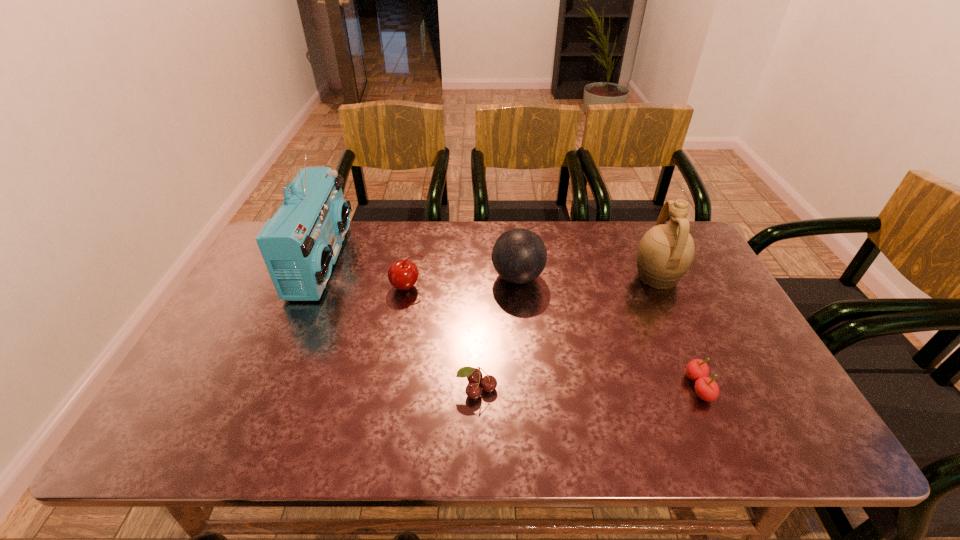
Image resolution: width=960 pixels, height=540 pixels. In order to click on radio receiver in this screenshot , I will do `click(300, 244)`.

Image resolution: width=960 pixels, height=540 pixels. What are the coordinates of `the leftmost object` in the screenshot? It's located at (300, 244).

The image size is (960, 540). What are the coordinates of `the second tallest object` in the screenshot? It's located at (665, 253).

You are a GUI agent. You are given a task and a screenshot of the screen. Output one action in this format:
    pyautogui.click(x=<x>, y=<y>)
    Task: Click on the fourth shortest object
    The width and height of the screenshot is (960, 540).
    Given the screenshot: What is the action you would take?
    pyautogui.click(x=519, y=256)

This screenshot has height=540, width=960. In order to click on the leftmost cherry in this screenshot , I will do `click(403, 275)`.

In order to click on the tallest cherry in this screenshot , I will do `click(403, 275)`.

Find the location of `the rightmost cherry`. the rightmost cherry is located at coordinates (707, 389).

The width and height of the screenshot is (960, 540). I want to click on the second cherry from right to left, so click(474, 376).

Locate an element on the screen. The image size is (960, 540). vacant region located 0.350m on the front-facing side of the radio receiver is located at coordinates (454, 261).

Locate an element on the screen. The image size is (960, 540). free space located 0.060m on the right of the pitcher is located at coordinates (702, 277).